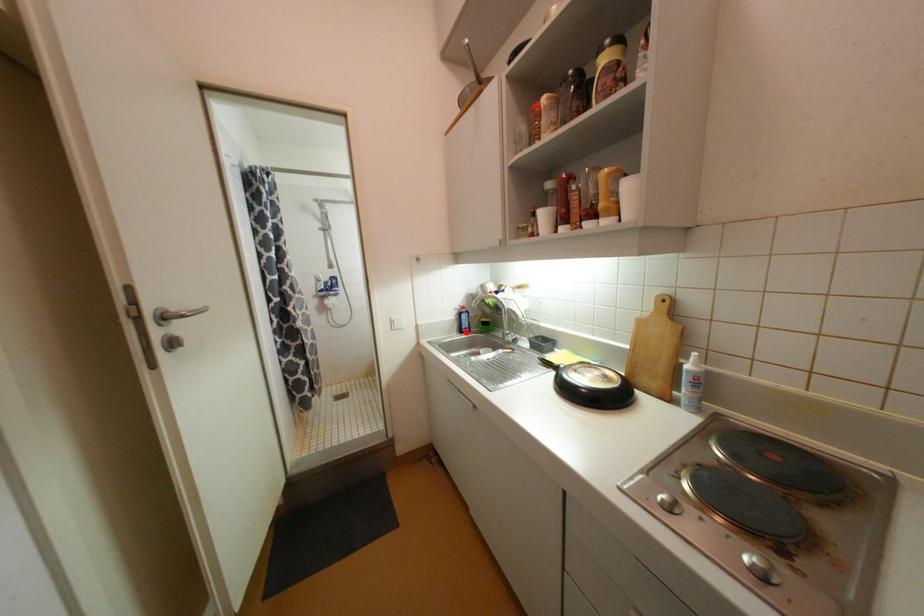
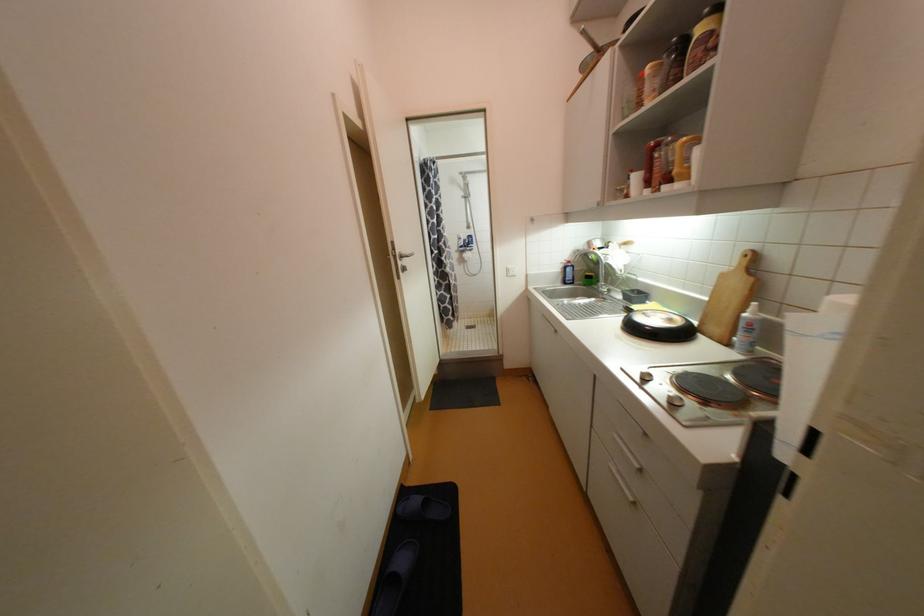
Locate, in the second image, the point that corresponds to the highlighted location in the first image.

(569, 283)